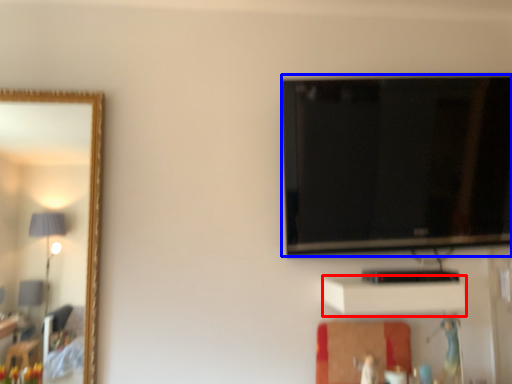
Question: Which of the following is the farthest to the observer, cabinet (highlighted by a red box) or television (highlighted by a blue box)?

Choices:
 (A) cabinet
 (B) television

Answer: (B)